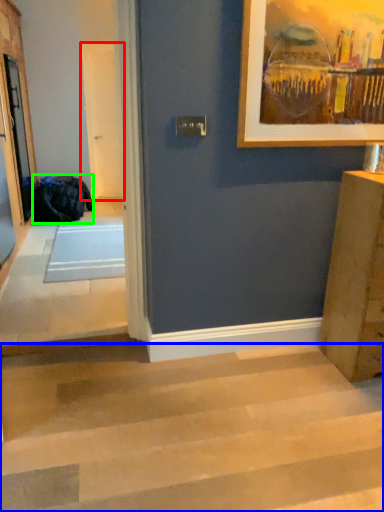
Question: Based on their relative distances, which object is nearer to screen door (highlighted by a red box)? Choose from stairwell (highlighted by a blue box) and laundry (highlighted by a green box).

Choices:
 (A) stairwell
 (B) laundry

Answer: (B)